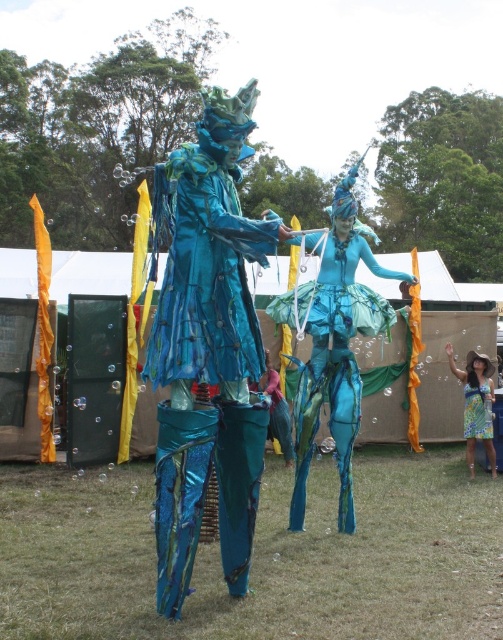
Can you confirm if metallic blue costume at center is positioned above teal metallic dress at lower right?

Yes, metallic blue costume at center is above teal metallic dress at lower right.

Who is lower down, metallic blue costume at center or teal metallic dress at lower right?

teal metallic dress at lower right

Which is behind, point (329, 385) or point (481, 428)?

Positioned behind is point (481, 428).

Image resolution: width=503 pixels, height=640 pixels. Identify the location of metallic blue costume at center. (333, 342).

Is point (242, 268) farther from viewer compared to point (472, 429)?

No, (242, 268) is closer to viewer.

Which is behind, point (189, 460) or point (465, 396)?

The point (465, 396) is more distant.

Where is `shiny metallic costume at center`? Image resolution: width=503 pixels, height=640 pixels. shiny metallic costume at center is located at coordinates (208, 348).

Who is more distant from viewer, [222,160] or [464,406]?

Positioned behind is point [464,406].

Does shiny metallic costume at center lie behind teal metallic dress at lower right?

No, it is not.

Who is more distant from viewer, [218,518] or [471,388]?

The point [471,388] is behind.

This screenshot has width=503, height=640. I want to click on shiny metallic costume at center, so click(208, 348).